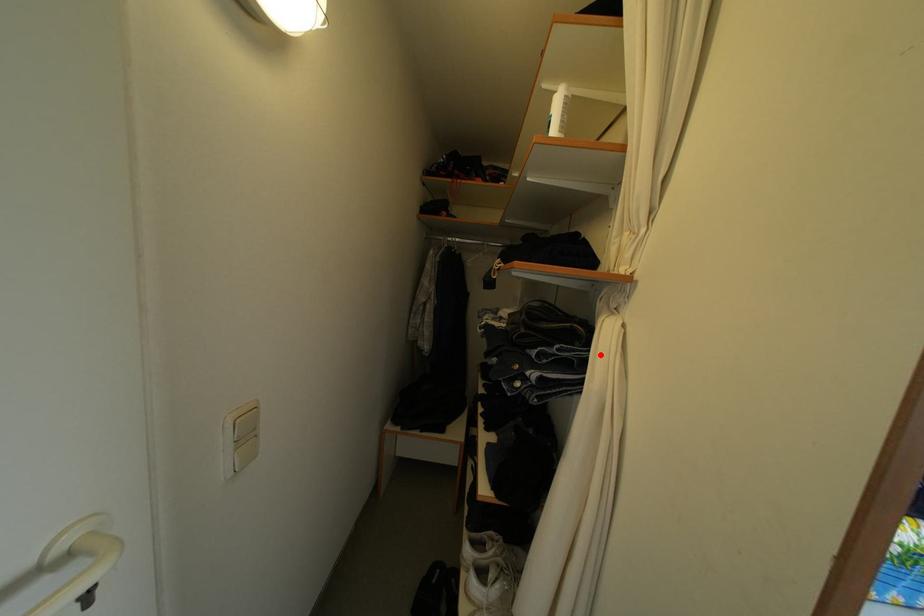
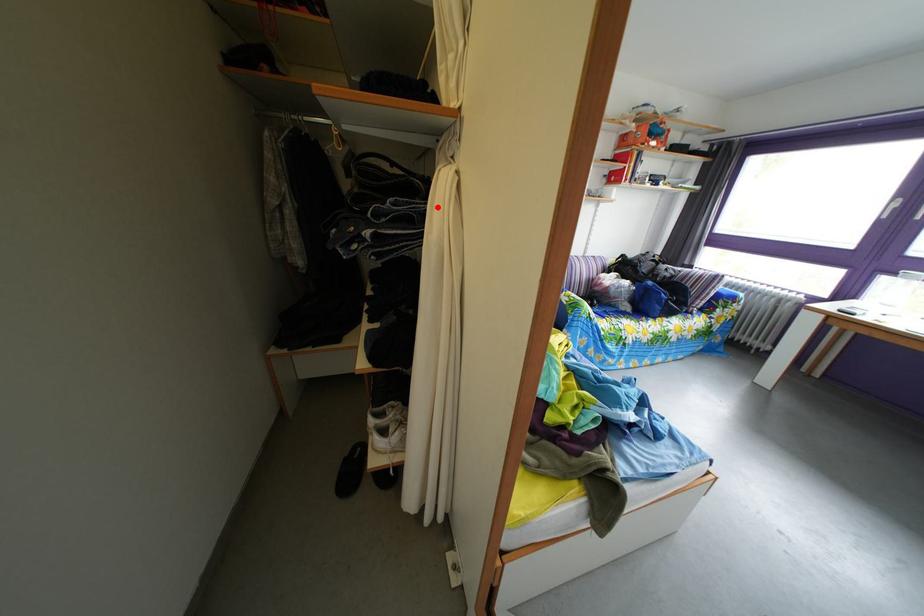
I am providing you with two images of the same scene from different viewpoints. A red point is marked on the first image and another point is marked on the second image. Does the point marked in image1 correspond to the same location as the one in image2?

Yes